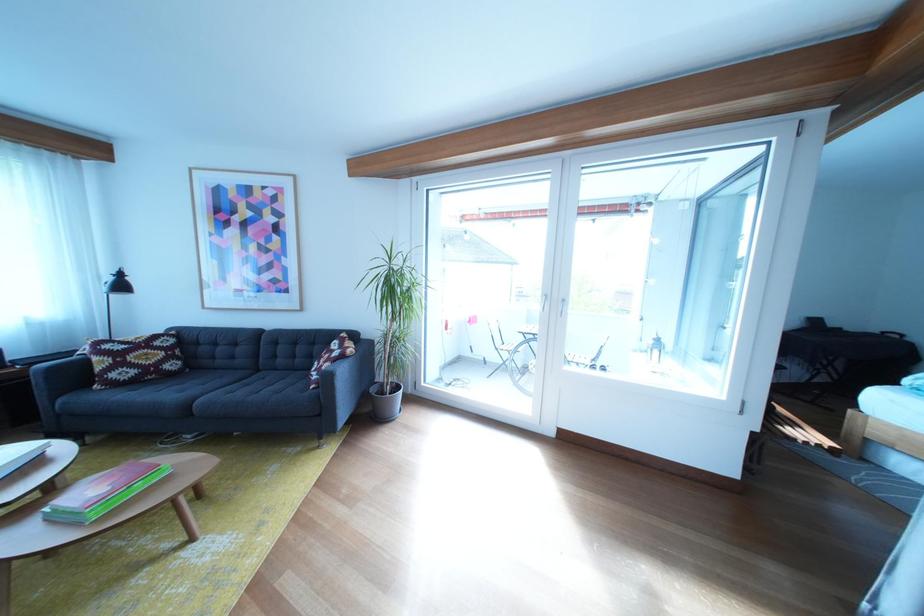
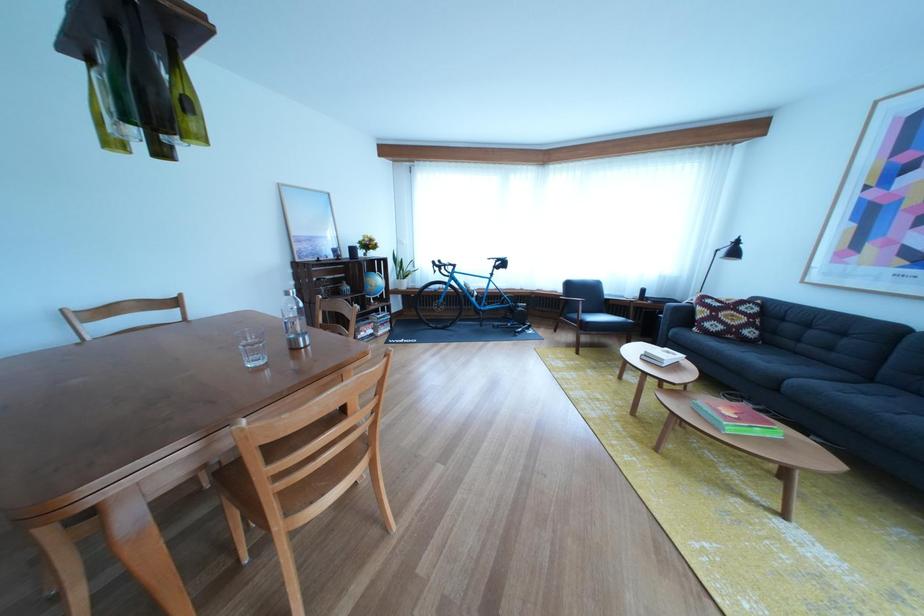
The point at (175, 360) is marked in the first image. Where is the corresponding point in the second image?

(757, 325)